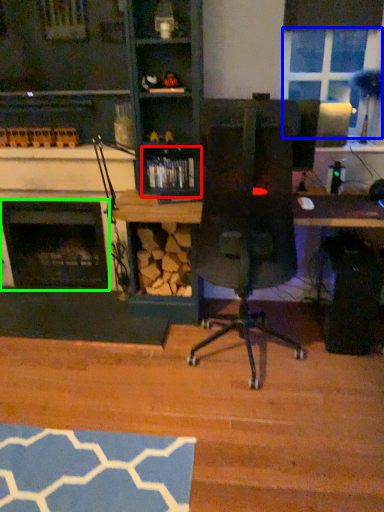
Question: Based on their relative distances, which object is nearer to shelf (highlighted by a red box)? Choose from window screen (highlighted by a blue box) and fireplace (highlighted by a green box).

Choices:
 (A) window screen
 (B) fireplace

Answer: (B)